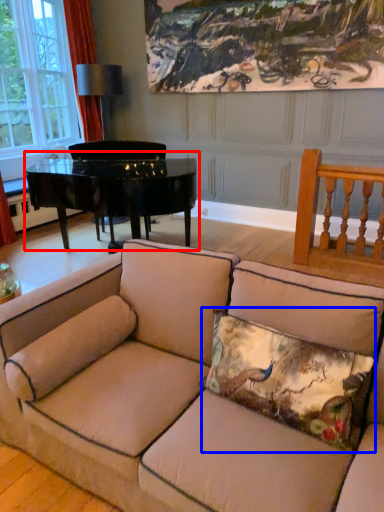
Question: Which object is further to the camera taking this photo, table (highlighted by a red box) or pillow (highlighted by a blue box)?

Choices:
 (A) table
 (B) pillow

Answer: (A)